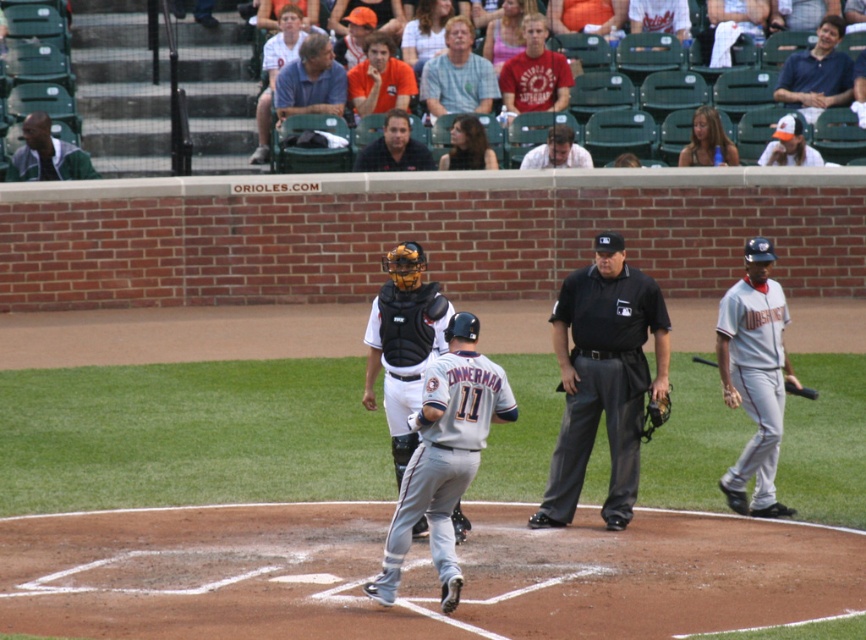
Question: Which of the following is the farthest from the observer?

Choices:
 (A) matte black helmet at upper center
 (B) matte gray helmet at center

Answer: (B)

Question: Which object appears farthest from the camera in this image?

Choices:
 (A) black leather baseball glove at center
 (B) green jersey at left
 (C) matte gray helmet at center

Answer: (C)

Question: Is orange shirt at upper center closer to camera compared to orange baseball cap at upper center?

Choices:
 (A) yes
 (B) no

Answer: (A)

Question: Does blue shirt at upper center come in front of orange baseball cap at upper right?

Choices:
 (A) yes
 (B) no

Answer: (B)

Question: Is orange shirt at upper center wider than green jersey at left?

Choices:
 (A) yes
 (B) no

Answer: (B)

Question: Which point is closer to the camera taking this photo?

Choices:
 (A) (563, 104)
 (B) (728, 298)
 (C) (304, 70)
 (D) (766, 156)

Answer: (B)